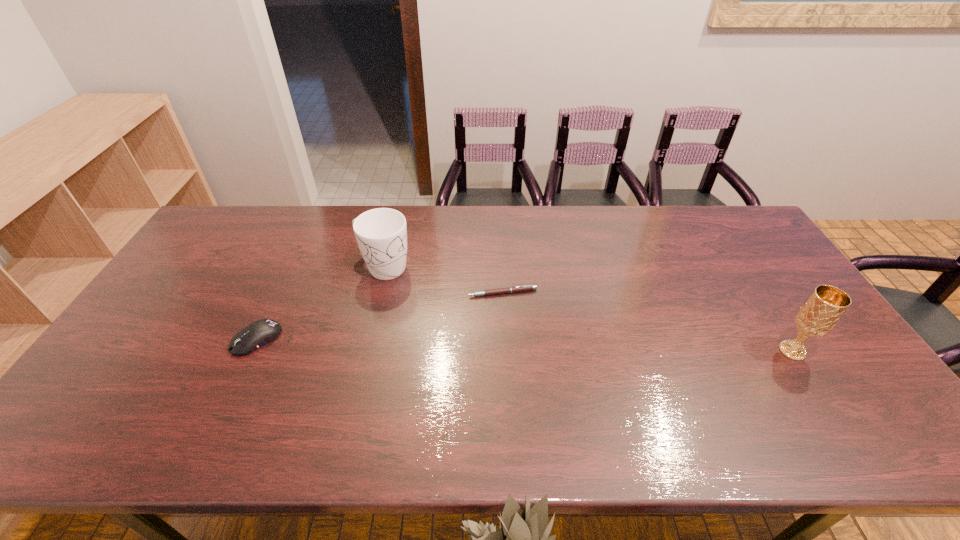
I want to click on free space located 0.330m at the nib of the second farthest object, so click(x=438, y=384).

The height and width of the screenshot is (540, 960). Identify the location of free space located 0.050m at the nib of the second farthest object. (482, 309).

At what (x,y) coordinates should I click in order to perform the action: click on vacant position located 0.070m on the side of the second object from left to right with the handle. Please return your answer as a coordinate pair (x, y). Looking at the image, I should click on (420, 289).

Locate an element on the screen. The width and height of the screenshot is (960, 540). vacant space located 0.270m on the side of the second object from left to right with the handle is located at coordinates (469, 320).

Where is `vacant space situated 0.240m on the side of the second object from left to right with the handle`? Image resolution: width=960 pixels, height=540 pixels. vacant space situated 0.240m on the side of the second object from left to right with the handle is located at coordinates (462, 315).

What are the coordinates of `object that is at the right edge` in the screenshot? It's located at (820, 313).

Where is `vacant space at the far edge`? The image size is (960, 540). vacant space at the far edge is located at coordinates (645, 227).

Find the location of a particular element. vacant space at the near edge of the desktop is located at coordinates (684, 387).

Where is `vacant space at the left edge of the desktop`? The image size is (960, 540). vacant space at the left edge of the desktop is located at coordinates (179, 321).

Where is `vacant space at the far left corner of the desktop`? Image resolution: width=960 pixels, height=540 pixels. vacant space at the far left corner of the desktop is located at coordinates (232, 206).